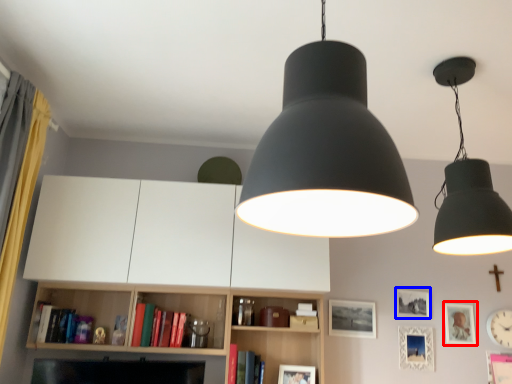
Question: Among these objects, which one is farthest to the camera, picture frame (highlighted by a red box) or picture frame (highlighted by a blue box)?

Choices:
 (A) picture frame
 (B) picture frame

Answer: (B)